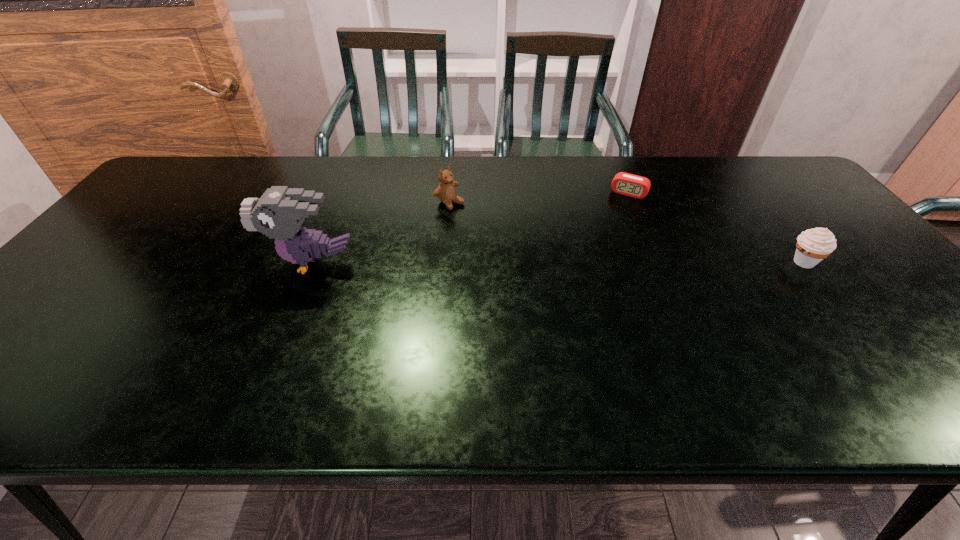
Find the location of `vacant spot on the desktop that is between the bird and the rightmost object and is positioned on the front-facing side of the second object from right to left`. vacant spot on the desktop that is between the bird and the rightmost object and is positioned on the front-facing side of the second object from right to left is located at coordinates (595, 262).

I want to click on vacant space on the desktop that is between the tallest object and the rightmost object and is positioned on the front-facing side of the teddy bear, so click(x=536, y=262).